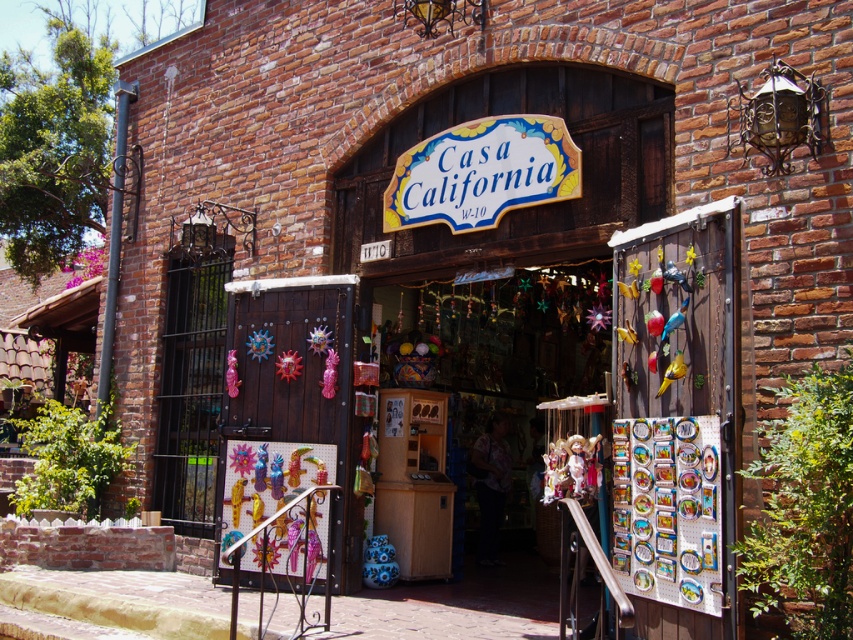
Who is more forward, [289,381] or [567,152]?

Positioned in front is point [567,152].

Locate an element on the screen. This screenshot has width=853, height=640. metallic painted door at center is located at coordinates 291,401.